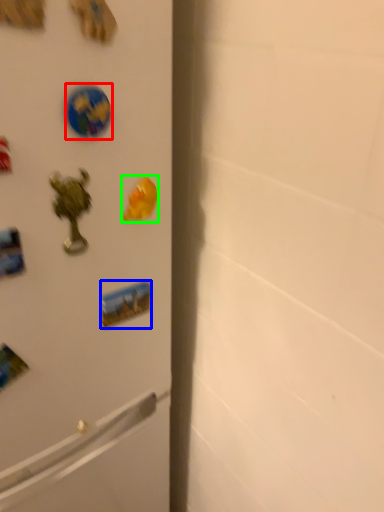
Question: Which is farther away from sticker (highlighted by a red box)? sticker (highlighted by a blue box) or magnet (highlighted by a green box)?

Choices:
 (A) sticker
 (B) magnet

Answer: (A)